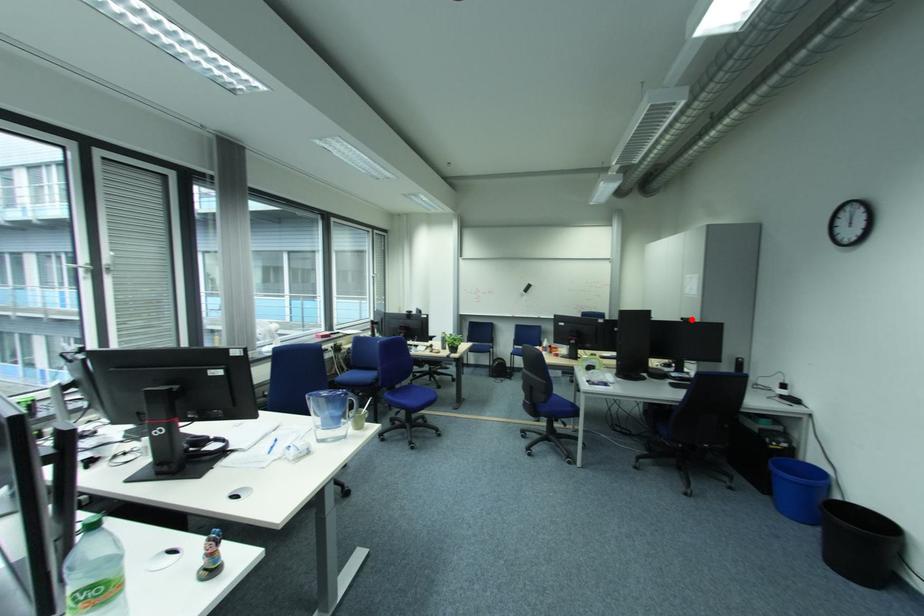
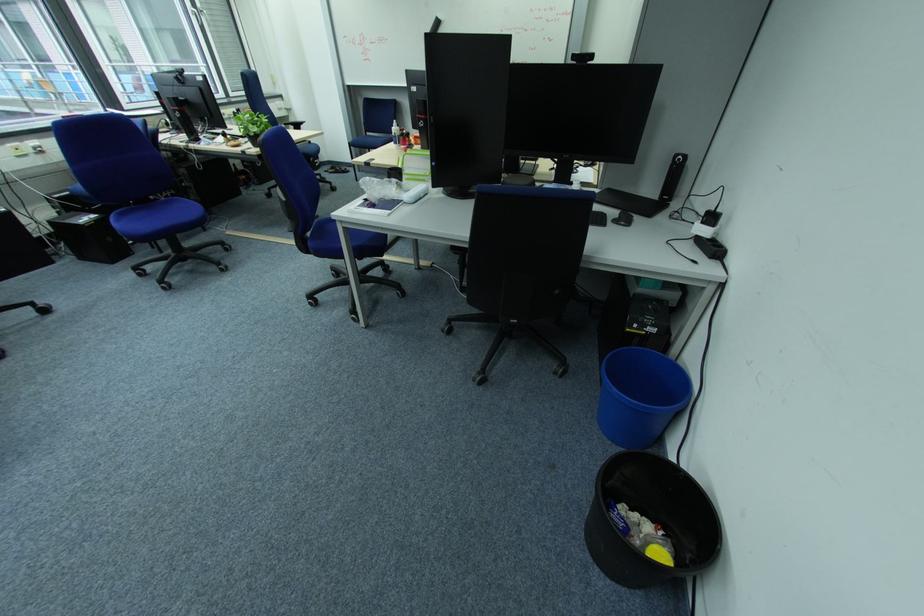
Locate, in the second image, the point that corresponds to the highlighted location in the first image.

(581, 57)